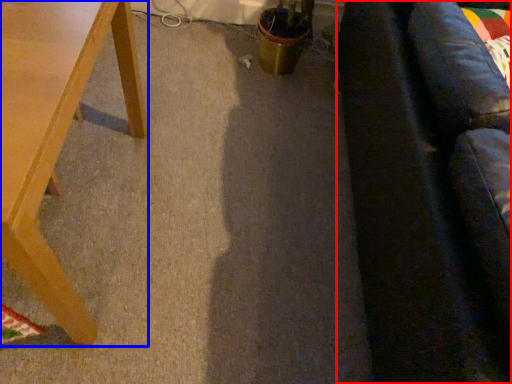
Question: Which point is closer to the camera, couch (highlighted by a red box) or table (highlighted by a blue box)?

Choices:
 (A) couch
 (B) table

Answer: (A)